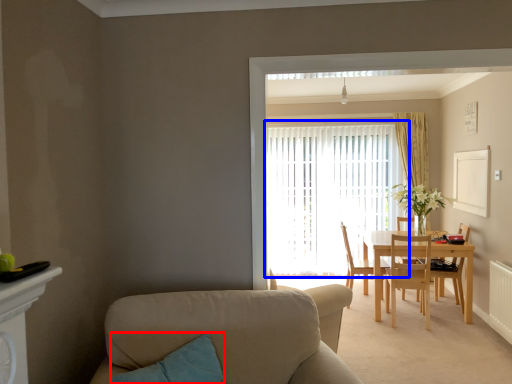
Question: Which object is closer to the camera taking this photo, pillow (highlighted by a red box) or window (highlighted by a blue box)?

Choices:
 (A) pillow
 (B) window

Answer: (A)